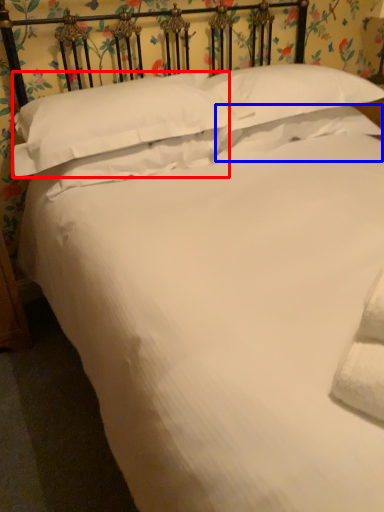
Question: Among these objects, which one is nearest to the camera, pillow (highlighted by a red box) or pillow (highlighted by a blue box)?

Choices:
 (A) pillow
 (B) pillow

Answer: (A)